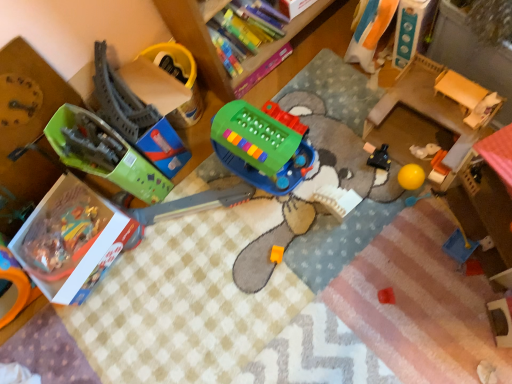
Identify the location of vacant location behind blue plastic dustpan at lower right, which ranks as the 1th toy in right-to-left order. The height and width of the screenshot is (384, 512). (417, 211).